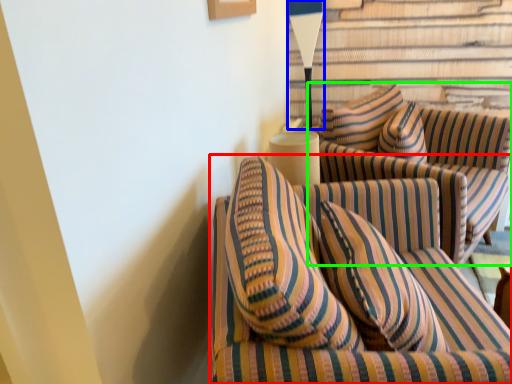
Question: Which object is the closest to the studio couch (highlighted by a red box)? Choose among these: table lamp (highlighted by a blue box) or studio couch (highlighted by a green box).

Choices:
 (A) table lamp
 (B) studio couch

Answer: (B)